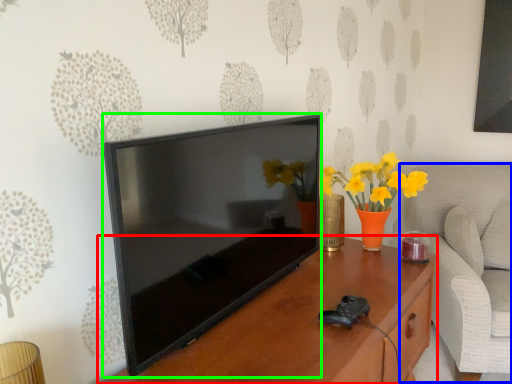
Question: Estimate the real-world distances between objects in this image. Which object is farther from table (highlighted by a red box), swivel chair (highlighted by a blue box) or television (highlighted by a green box)?

Choices:
 (A) swivel chair
 (B) television

Answer: (A)